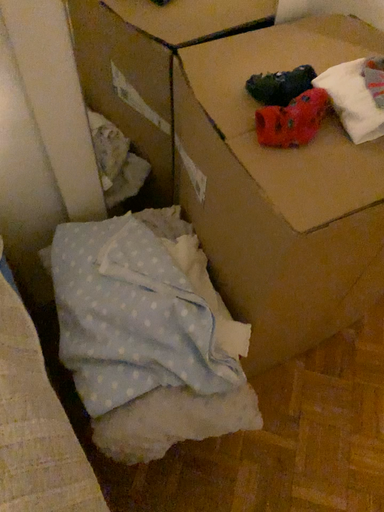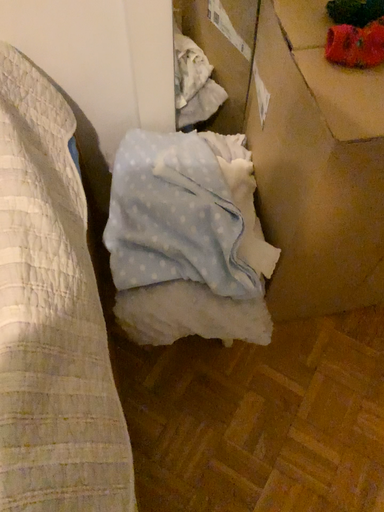
Question: How did the camera likely rotate when shooting the video?

Choices:
 (A) rotated right
 (B) rotated left

Answer: (B)